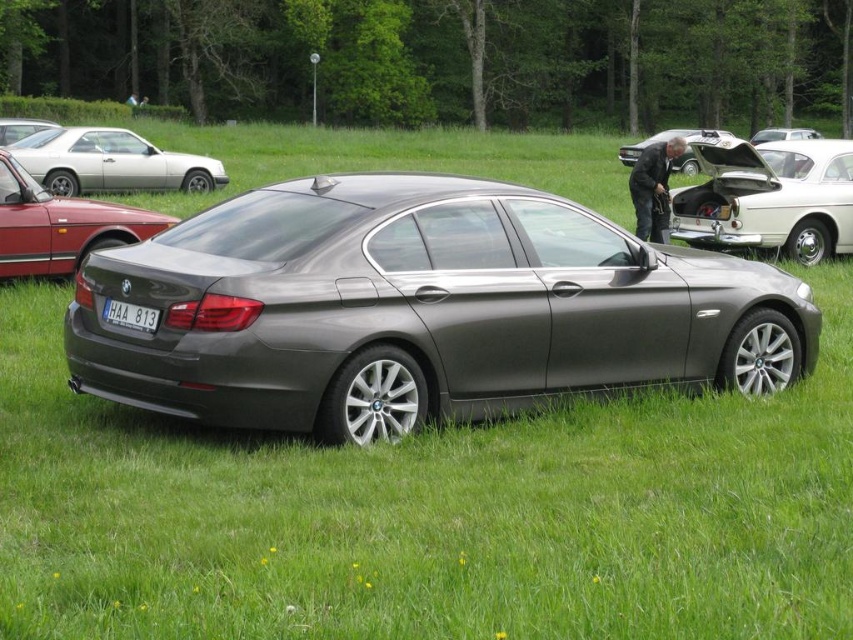
Can you confirm if matte black car at upper left is positioned to the right of metallic silver sedan at center?

In fact, matte black car at upper left is to the left of metallic silver sedan at center.

Who is positioned more to the right, matte black car at upper left or metallic silver sedan at center?

metallic silver sedan at center

What do you see at coordinates (20, 129) in the screenshot? This screenshot has height=640, width=853. I see `matte black car at upper left` at bounding box center [20, 129].

At what (x,y) coordinates should I click in order to perform the action: click on matte black car at upper left. Please return your answer as a coordinate pair (x, y). Looking at the image, I should click on (20, 129).

Who is shorter, metallic silver coupe at upper left or metallic silver car at center?

Standing shorter between the two is metallic silver coupe at upper left.

Can you confirm if metallic silver coupe at upper left is positioned to the left of metallic silver car at center?

Yes, metallic silver coupe at upper left is to the left of metallic silver car at center.

Between point (103, 134) and point (698, 129), which one is positioned behind?

The point (698, 129) is more distant.

The width and height of the screenshot is (853, 640). What are the coordinates of `metallic silver coupe at upper left` in the screenshot? It's located at (111, 163).

Based on the photo, is metallic silver coupe at upper left to the left of matte black car at upper left from the viewer's perspective?

Incorrect, metallic silver coupe at upper left is not on the left side of matte black car at upper left.

Locate an element on the screen. This screenshot has width=853, height=640. metallic silver coupe at upper left is located at coordinates (111, 163).

Is point (164, 189) behind point (39, 128)?

That is False.

Locate an element on the screen. This screenshot has width=853, height=640. metallic silver coupe at upper left is located at coordinates (111, 163).